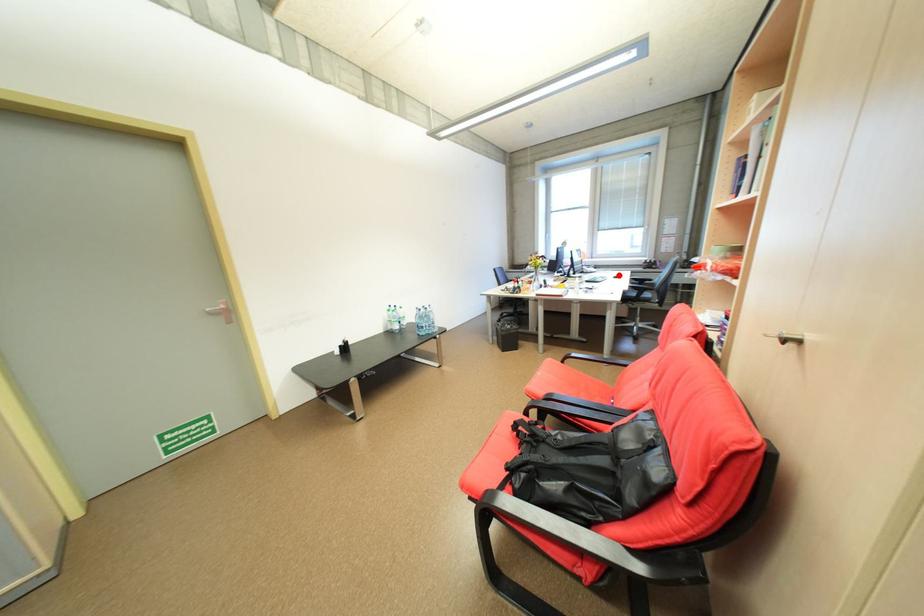
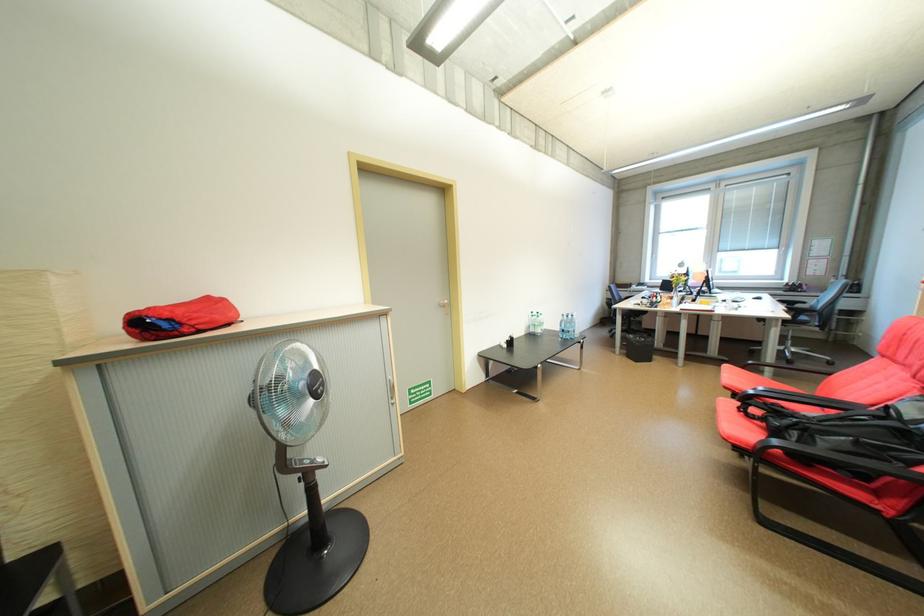
Question: I am providing you with two images of the same scene from different viewpoints. A red point is marked on the first image. At the location where the point appears in image 1, is it still visible in image 2?

Choices:
 (A) Yes
 (B) No

Answer: (A)